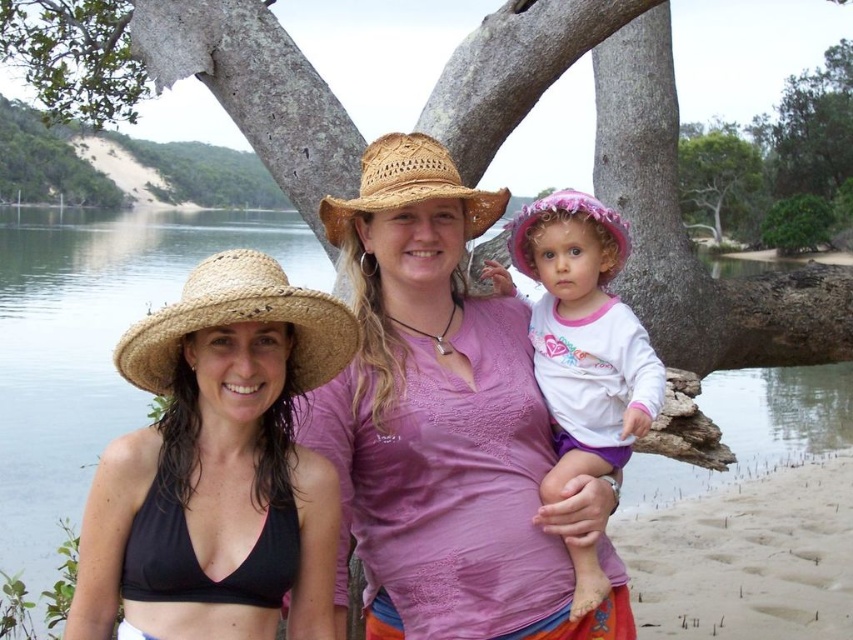
Does matte straw hat at left appear on the right side of straw woven hat at center?

Incorrect, matte straw hat at left is not on the right side of straw woven hat at center.

Who is lower down, matte straw hat at left or straw woven hat at center?

Positioned lower is matte straw hat at left.

Which is behind, point (306, 337) or point (405, 152)?

The point (405, 152) is behind.

Identify the location of matte straw hat at left. The height and width of the screenshot is (640, 853). (219, 451).

From the picture: Does rough bark tree at center have a smaller size compared to green leafy tree at upper center?

Indeed, rough bark tree at center has a smaller size compared to green leafy tree at upper center.

Is rough bark tree at center above green leafy tree at upper center?

Actually, rough bark tree at center is below green leafy tree at upper center.

Is point (711, 336) farther from camera compared to point (737, 147)?

No, (711, 336) is closer to viewer.

You are a GUI agent. You are given a task and a screenshot of the screen. Output one action in this format:
    pyautogui.click(x=<x>, y=<y>)
    Task: Click on the rough bark tree at center
    The height and width of the screenshot is (640, 853).
    Given the screenshot: What is the action you would take?
    pyautogui.click(x=634, y=177)

Looking at this image, is matte straw hat at left thinner than green leafy tree at upper center?

Yes.

Is matte straw hat at left above green leafy tree at upper center?

Actually, matte straw hat at left is below green leafy tree at upper center.

The image size is (853, 640). Describe the element at coordinates (219, 451) in the screenshot. I see `matte straw hat at left` at that location.

Locate an element on the screen. matte straw hat at left is located at coordinates (219, 451).